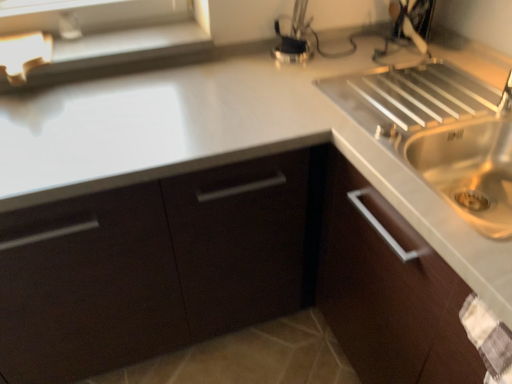
Where is `empty space that is ontop of matte white window sill at upper left (from a real-world perspective)`? empty space that is ontop of matte white window sill at upper left (from a real-world perspective) is located at coordinates (112, 43).